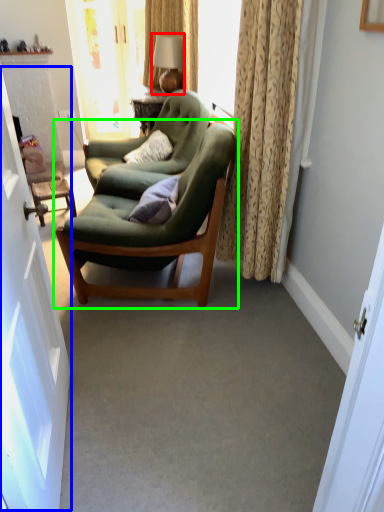
Question: Based on their relative distances, which object is nearer to lamp (highlighted by a red box)? Choose from screen door (highlighted by a blue box) and chair (highlighted by a green box).

Choices:
 (A) screen door
 (B) chair

Answer: (B)